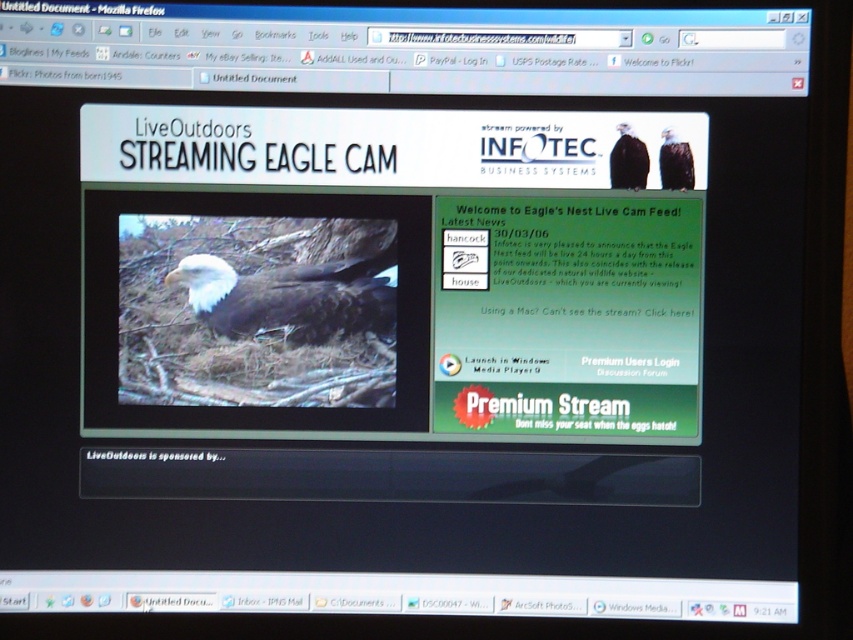
Where is `matte black eagle at upper right`? This screenshot has height=640, width=853. matte black eagle at upper right is located at coordinates (628, 161).

Is point (635, 141) farther from camera compared to point (668, 176)?

Yes, point (635, 141) is behind point (668, 176).

The height and width of the screenshot is (640, 853). What do you see at coordinates (628, 161) in the screenshot?
I see `matte black eagle at upper right` at bounding box center [628, 161].

You are a GUI agent. You are given a task and a screenshot of the screen. Output one action in this format:
    pyautogui.click(x=<x>, y=<y>)
    Task: Click on the matte black eagle at upper right
    
    Given the screenshot: What is the action you would take?
    pyautogui.click(x=628, y=161)

Which of these two, white feathered eagle at center or dark brown feathers at upper right, stands shorter?

dark brown feathers at upper right

Is white feathered eagle at center to the left of dark brown feathers at upper right from the viewer's perspective?

Yes, white feathered eagle at center is to the left of dark brown feathers at upper right.

Is point (271, 316) behind point (672, 186)?

Yes, point (271, 316) is farther from viewer.

The image size is (853, 640). In order to click on white feathered eagle at center in this screenshot , I will do [x=289, y=298].

Does point (283, 310) lie behind point (624, 182)?

Yes, point (283, 310) is behind point (624, 182).

At what (x,y) coordinates should I click in order to perform the action: click on white feathered eagle at center. Please return your answer as a coordinate pair (x, y). Looking at the image, I should click on (289, 298).